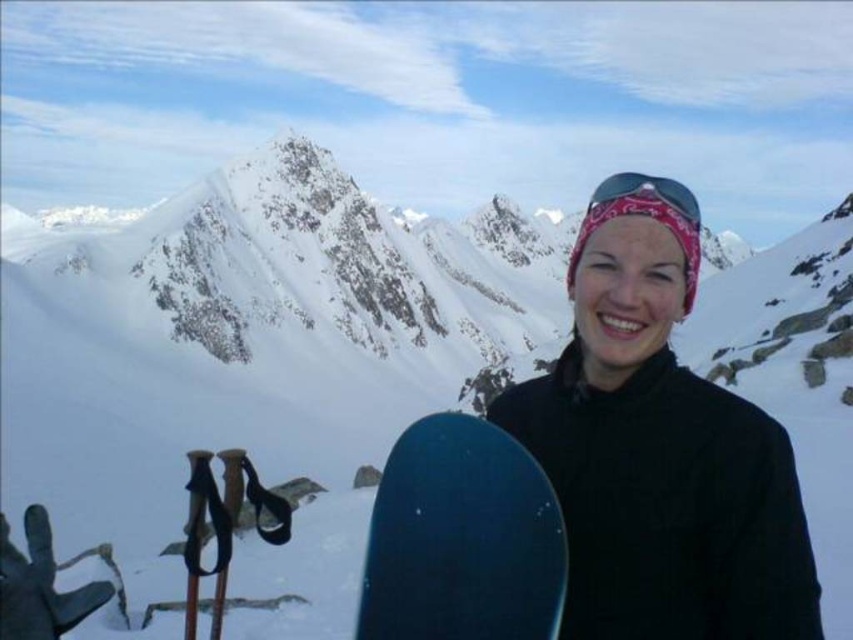
You are standing in a snowy mountain area and want to reach a specific point marked at coordinates point (790, 488). If you can walk 50 meters in 10 minutes, how long will it take you to reach that point?

The point (790, 488) is 42.54 meters away from the viewer. Since you can walk 50 meters in 10 minutes, it will take approximately 8.5 minutes to reach the point.

You are a photographer trying to capture the snowboard in the image. The snowboard is located at point (659, 456). Can you confirm if the snowboard at this point is the matte black snowboard at lower center?

Yes, the point (659, 456) marks the matte black snowboard at lower center.

You are a photographer trying to capture the blue matte snowboard at center and the pink fabric bandana at upper center in a single shot. Based on their positions, which object will appear closer to the camera in the photo?

The blue matte snowboard at center will appear closer to the camera because it is positioned in front of the pink fabric bandana at upper center.